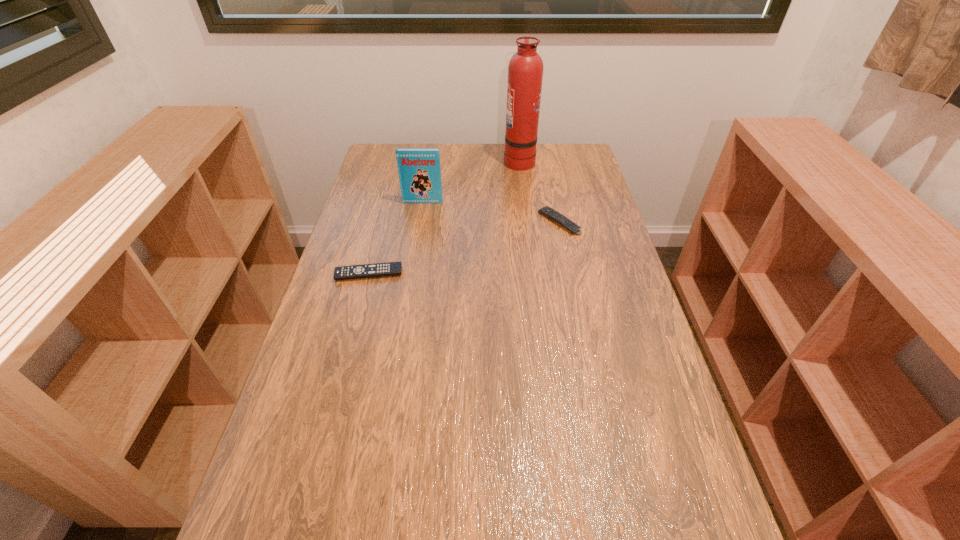
This screenshot has width=960, height=540. In the image, there is a desktop. What are the coordinates of `vacant space at the right edge` in the screenshot? It's located at (693, 466).

I want to click on unoccupied position between the fire extinguisher and the right remote control, so click(539, 191).

Identify the location of empty space that is in between the farther remote control and the left remote control. (464, 248).

The width and height of the screenshot is (960, 540). I want to click on the closest object to the book, so click(525, 71).

Choose which object is the third nearest neighbor to the fire extinguisher. Please provide its 2D coordinates. Your answer should be formatted as a tuple, i.e. [(x, y)], where the tuple contains the x and y coordinates of a point satisfying the conditions above.

[(391, 268)]

At what (x,y) coordinates should I click in order to perform the action: click on remote control object that ranks as the second closest to the farthest object. Please return your answer as a coordinate pair (x, y). This screenshot has width=960, height=540. Looking at the image, I should click on (391, 268).

Where is `vacant area that satisfies the following two spatial constraints: 1. on the front cover of the third farthest object; 2. on the right side of the book`? Image resolution: width=960 pixels, height=540 pixels. vacant area that satisfies the following two spatial constraints: 1. on the front cover of the third farthest object; 2. on the right side of the book is located at coordinates (420, 222).

Find the location of a particular element. This screenshot has height=540, width=960. free space that satisfies the following two spatial constraints: 1. on the label side of the right remote control; 2. on the right side of the tallest object is located at coordinates (527, 222).

The height and width of the screenshot is (540, 960). What are the coordinates of `vacant position in the image that satisfies the following two spatial constraints: 1. on the label side of the farthest object; 2. on the left side of the farther remote control` in the screenshot? It's located at (527, 222).

In order to click on free point that satisfies the following two spatial constraints: 1. on the label side of the farther remote control; 2. on the right side of the fire extinguisher in this screenshot , I will do `click(527, 222)`.